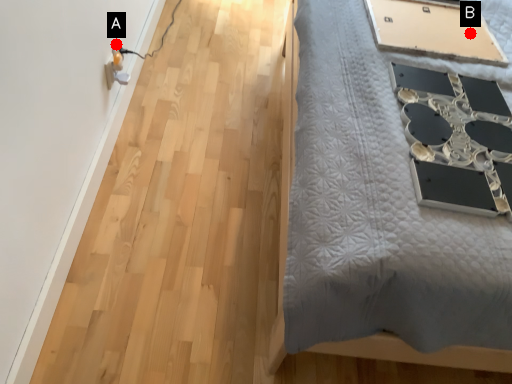
Question: Two points are circled on the image, labeled by A and B beside each circle. Which point is closer to the camera?

Choices:
 (A) A is closer
 (B) B is closer

Answer: (B)